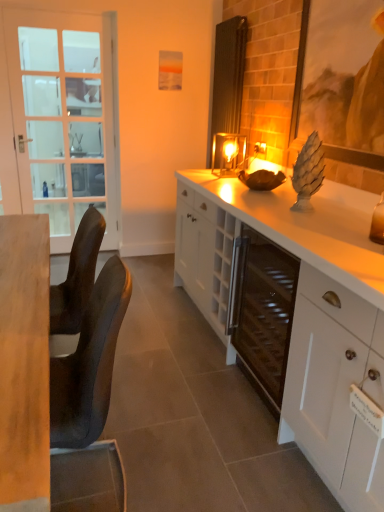
Question: Do you think white glossy cabinet at center is within light brown wood desk at left, or outside of it?

Choices:
 (A) outside
 (B) inside

Answer: (A)

Question: From the image's perspective, relative to light brown wood desk at left, is white glossy cabinet at center above or below?

Choices:
 (A) above
 (B) below

Answer: (A)

Question: Which object is positioned farthest from the white matte cabinet at lower right?

Choices:
 (A) matte wooden picture frame at upper right
 (B) black leather chair at left
 (C) light brown wood desk at left
 (D) metallic glass candle holder at center
 (E) white glossy cabinet at center

Answer: (D)

Question: Considering the real-world distances, which object is farthest from the black leather chair at left?

Choices:
 (A) white glossy cabinet at center
 (B) white matte cabinet at lower right
 (C) matte wooden picture frame at upper right
 (D) white glass screen door at left
 (E) light brown wood desk at left

Answer: (D)